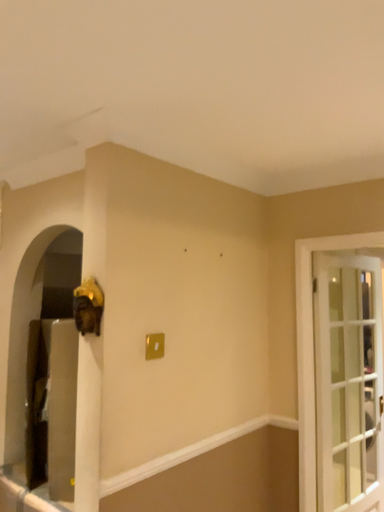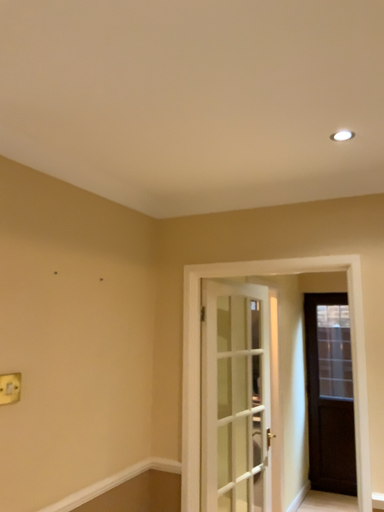
Question: Which way did the camera rotate in the video?

Choices:
 (A) rotated left
 (B) rotated right

Answer: (B)